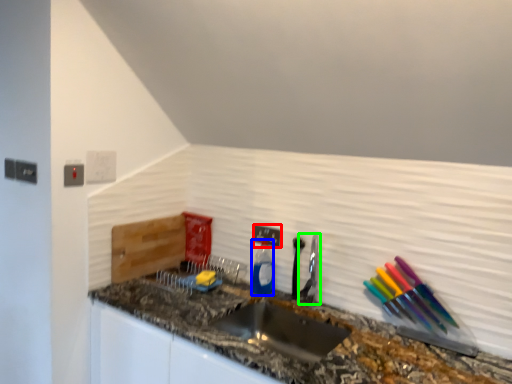
Question: Based on their relative distances, which object is nearer to electric outlet (highlighted by a red box)? Choose from bottle (highlighted by a blue box) and faucet (highlighted by a green box).

Choices:
 (A) bottle
 (B) faucet

Answer: (A)